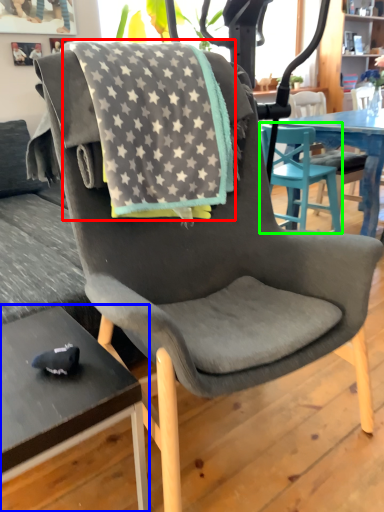
Question: Estimate the real-world distances between objects in this image. Which object is farther from beach towel (highlighted by a red box), desk (highlighted by a blue box) or chair (highlighted by a green box)?

Choices:
 (A) desk
 (B) chair

Answer: (B)